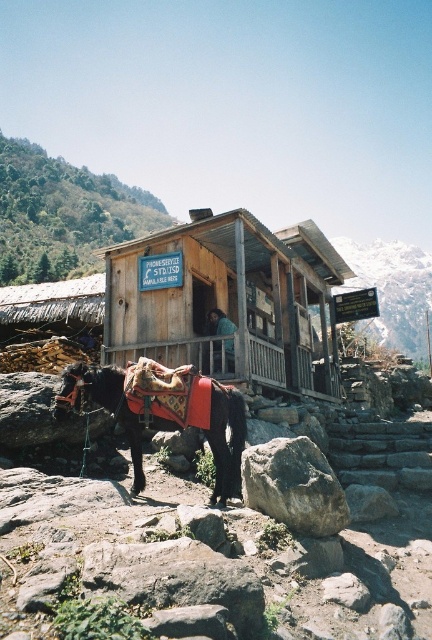
You are a hiker who needs to place a small first aid kit on the ground near the black horse. Which rock would be more stable to place it on, the smooth gray rock at lower center or the gray rough rock at lower center?

The smooth gray rock at lower center has a larger width than the gray rough rock at lower center, making it more stable for placing the first aid kit.

From the picture: You are standing at the entrance of the rustic wooden structure and want to walk to the black horse. There are two points marked on the ground as reference points. Which point, point [205,230] or point [301,496], is closer to you as you start walking towards the horse?

Point [205,230] is closer to you since it is further to the camera than point [301,496], meaning it is nearer to your current position at the entrance.

You are a hiker who wants to take a photo of the wooden hut at center and the gray rough rock at lower center. To ensure both are in focus, you need to know their height relationship. Which one is taller?

The wooden hut at center is taller than the gray rough rock at lower center according to the description.